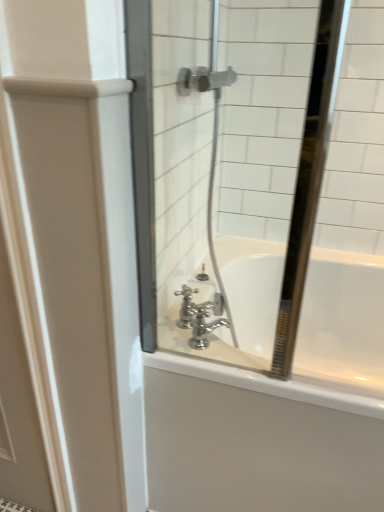
Question: Considering the relative sizes of white glossy door at left and chrome metallic faucet at center in the image provided, is white glossy door at left shorter than chrome metallic faucet at center?

Choices:
 (A) yes
 (B) no

Answer: (B)

Question: Could you tell me if white glossy door at left is facing chrome metallic faucet at center?

Choices:
 (A) no
 (B) yes

Answer: (A)

Question: Would you consider white glossy door at left to be distant from chrome metallic faucet at center?

Choices:
 (A) yes
 (B) no

Answer: (B)

Question: Can you confirm if white glossy door at left is wider than chrome metallic faucet at center?

Choices:
 (A) yes
 (B) no

Answer: (B)

Question: Is white glossy door at left at the right side of chrome metallic faucet at center?

Choices:
 (A) yes
 (B) no

Answer: (B)

Question: Is white glossy door at left located outside chrome metallic faucet at center?

Choices:
 (A) yes
 (B) no

Answer: (A)

Question: Does chrome metallic faucet at center have a greater width compared to white glossy bathtub at center?

Choices:
 (A) no
 (B) yes

Answer: (A)

Question: From the image's perspective, is chrome metallic faucet at center located above white glossy bathtub at center?

Choices:
 (A) no
 (B) yes

Answer: (B)

Question: Can we say chrome metallic faucet at center lies outside white glossy bathtub at center?

Choices:
 (A) no
 (B) yes

Answer: (B)

Question: From the image's perspective, is chrome metallic faucet at center below white glossy bathtub at center?

Choices:
 (A) yes
 (B) no

Answer: (B)

Question: From a real-world perspective, is chrome metallic faucet at center under white glossy bathtub at center?

Choices:
 (A) no
 (B) yes

Answer: (A)

Question: Does chrome metallic faucet at center have a larger size compared to white glossy bathtub at center?

Choices:
 (A) no
 (B) yes

Answer: (A)

Question: From a real-world perspective, is clear glass mirror at center over white glossy door at left?

Choices:
 (A) yes
 (B) no

Answer: (A)